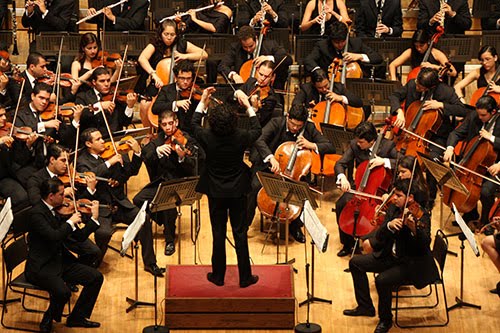
Locate an element on the screen. Image resolution: width=500 pixels, height=333 pixels. base of music stands is located at coordinates (313, 300), (136, 305), (465, 302), (450, 249), (291, 258), (7, 303).